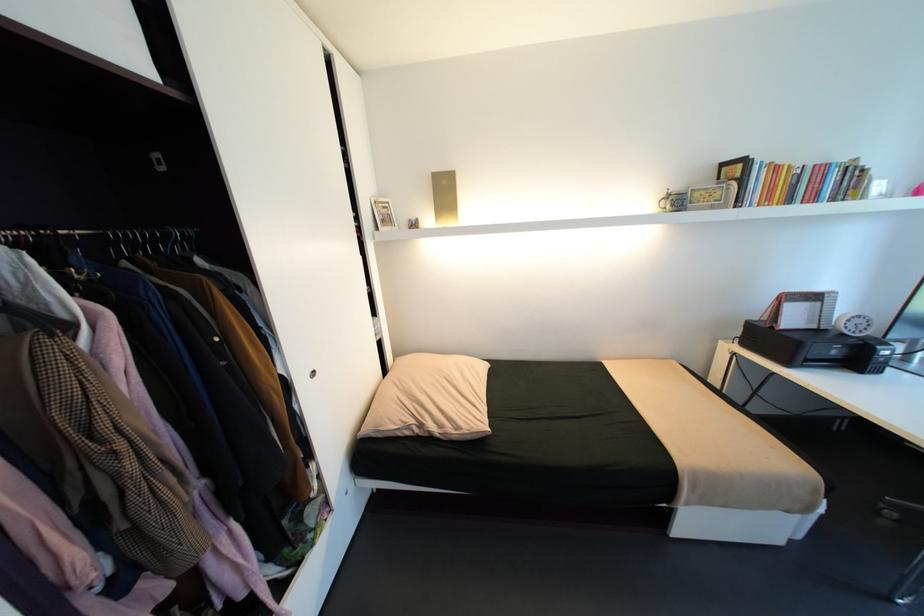
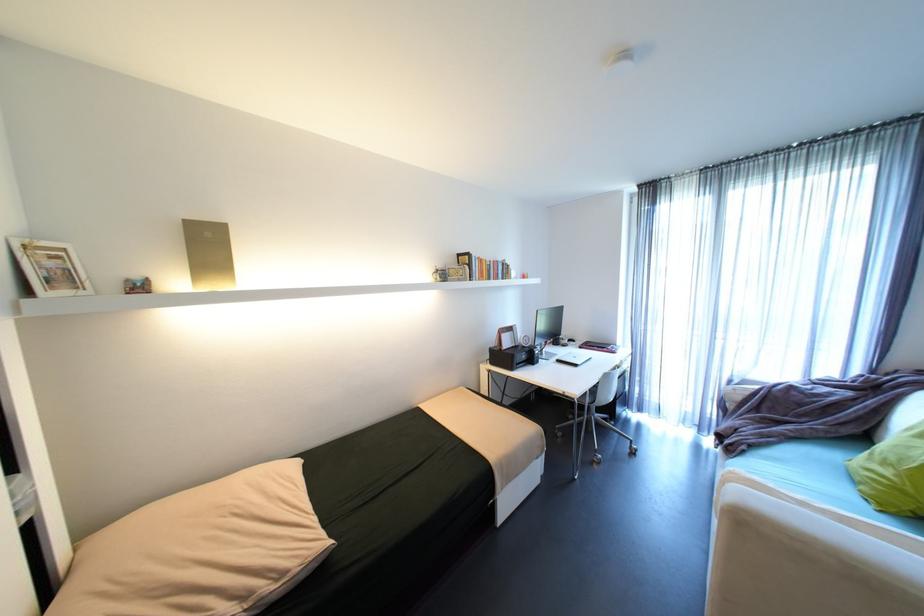
Find the pixel in the second image that matches pixel 821 166 in the first image.

(500, 262)